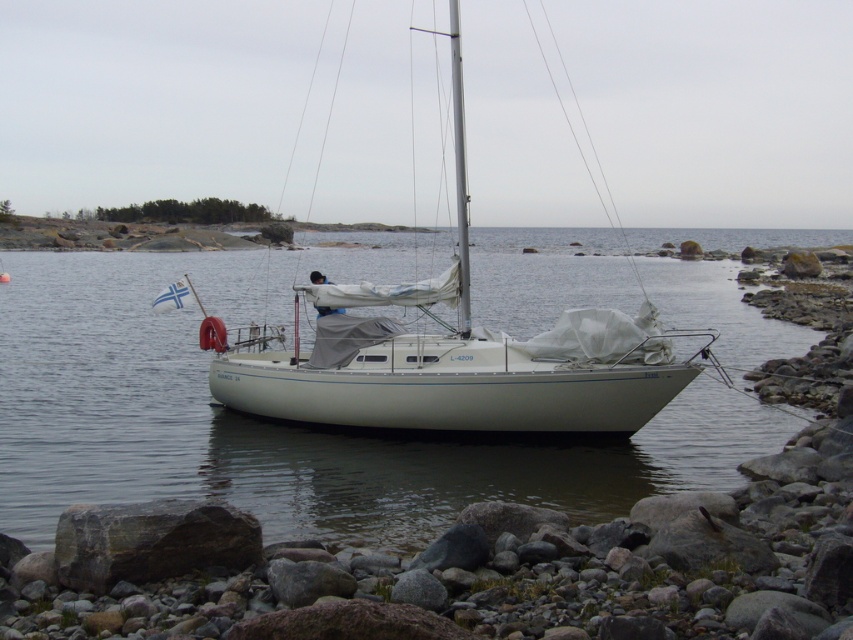
Is point (65, 458) positioned after point (434, 339)?

No.

This screenshot has height=640, width=853. Find the location of `white water at center`. white water at center is located at coordinates (286, 422).

Find the location of `white water at center`. white water at center is located at coordinates (286, 422).